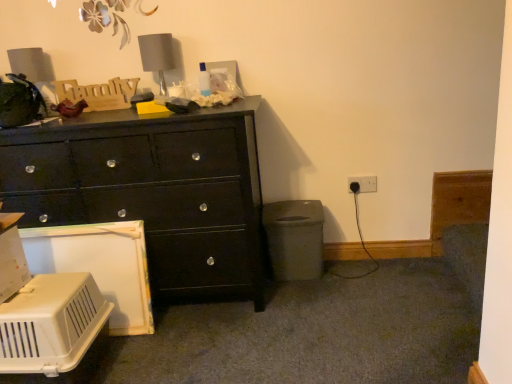
Question: Considering their positions, is gray fabric lampshade at upper center located in front of or behind white plastic pet carrier at lower left?

Choices:
 (A) behind
 (B) front

Answer: (A)

Question: Visually, is gray fabric lampshade at upper center positioned to the left or to the right of white plastic pet carrier at lower left?

Choices:
 (A) right
 (B) left

Answer: (A)

Question: Which object is the farthest from the black glossy chest of drawers at left?

Choices:
 (A) gray fabric lampshade at upper center
 (B) black plastic electric outlet at lower right
 (C) white plastic pet carrier at lower left

Answer: (B)

Question: Which is farther from the black plastic electric outlet at lower right?

Choices:
 (A) white plastic pet carrier at lower left
 (B) black glossy chest of drawers at left
 (C) gray fabric lampshade at upper center

Answer: (A)